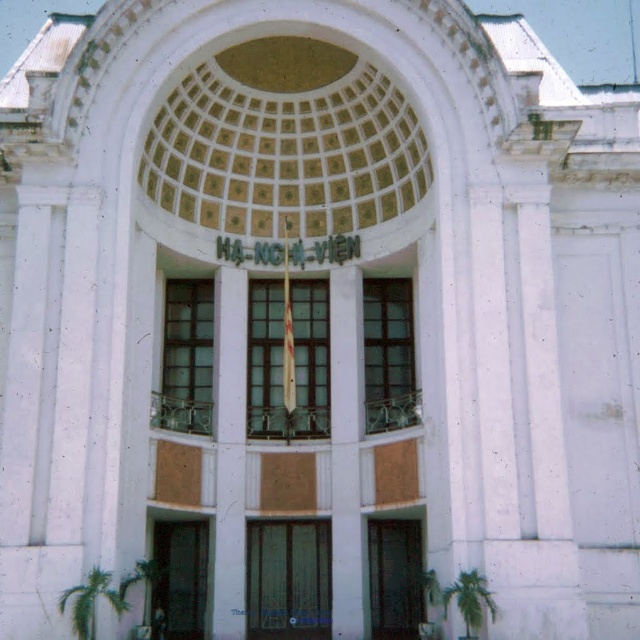
Does matte glass door at lower center appear under metallic glass door at lower center?

Actually, matte glass door at lower center is above metallic glass door at lower center.

Is matte glass door at lower center positioned before metallic glass door at lower center?

Yes, it is in front of metallic glass door at lower center.

Looking at this image, who is more distant from viewer, (168, 531) or (410, 522)?

The point (410, 522) is more distant.

Find the location of `matte glass door at lower center`. matte glass door at lower center is located at coordinates (179, 579).

Describe the element at coordinates (289, 579) in the screenshot. I see `green textured door at center` at that location.

Does green textured door at center have a lesser width compared to matte glass door at lower center?

No, green textured door at center is not thinner than matte glass door at lower center.

Is point (296, 637) behind point (172, 529)?

No, it is not.

Where is `green textured door at center`? This screenshot has height=640, width=640. green textured door at center is located at coordinates (289, 579).

Is green textured door at center closer to camera compared to metallic glass door at lower center?

No, green textured door at center is further to the viewer.

Which is above, green textured door at center or metallic glass door at lower center?

metallic glass door at lower center

Is point (294, 545) positioned before point (412, 584)?

No, (294, 545) is further to viewer.

Where is `green textured door at center`? green textured door at center is located at coordinates click(x=289, y=579).